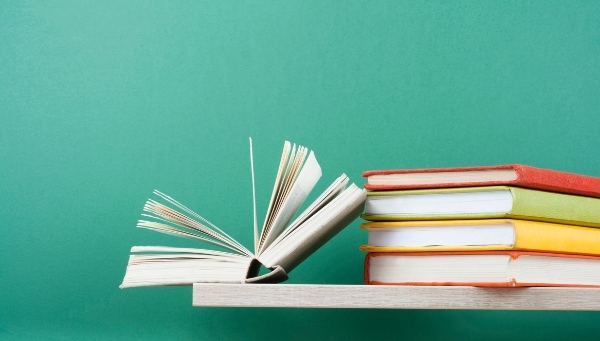
This screenshot has width=600, height=341. Identify the location of stacked books. (492, 179), (498, 201), (501, 226), (513, 270).